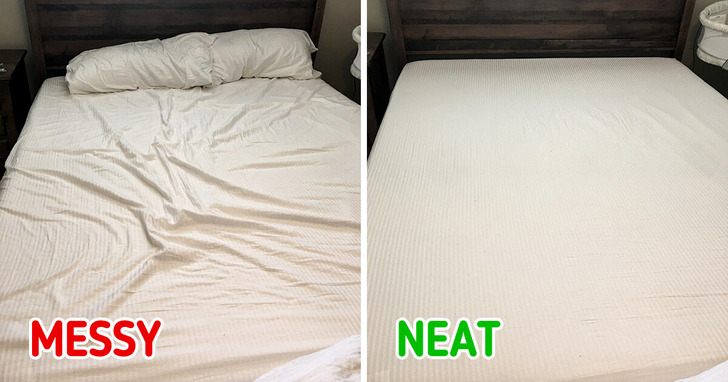
Identify the location of pillows. This screenshot has height=382, width=728. (162, 66), (226, 54).